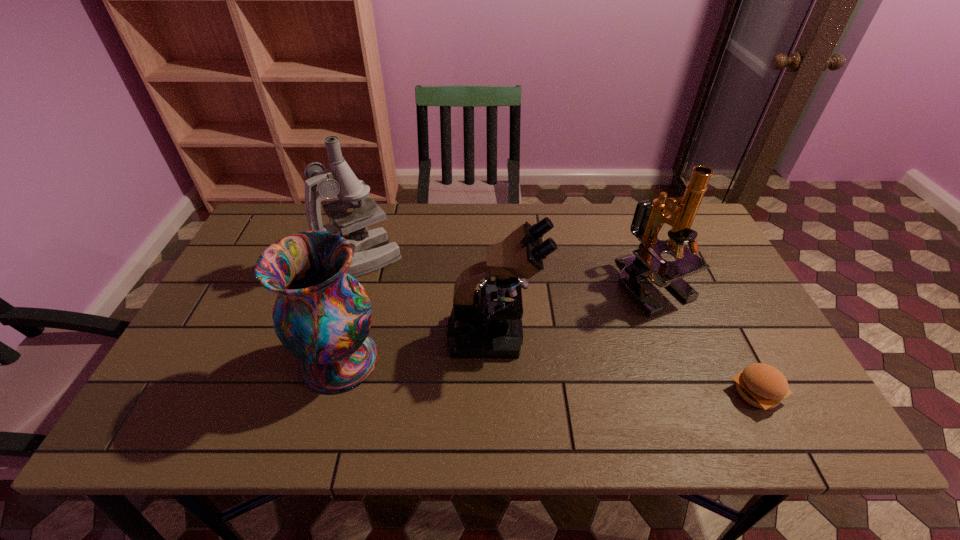
This screenshot has width=960, height=540. In order to click on the leftmost microscope in this screenshot , I will do `click(371, 250)`.

What are the coordinates of `the rightmost microscope` in the screenshot? It's located at (649, 217).

Identify the location of the third object from left to right. (479, 327).

Where is `vase`? This screenshot has height=540, width=960. vase is located at coordinates (322, 315).

This screenshot has height=540, width=960. Identify the location of hamburger. (761, 385).

Image resolution: width=960 pixels, height=540 pixels. I want to click on free region located on the back of the leftmost microscope, so click(x=370, y=228).

Locate an element on the screen. This screenshot has width=960, height=540. vacant space located at the eyepiece of the rightmost microscope is located at coordinates (697, 392).

Locate an element on the screen. Image resolution: width=960 pixels, height=540 pixels. vacant space positioned on the left of the third object from right to left is located at coordinates (x=385, y=335).

This screenshot has height=540, width=960. What are the coordinates of `vacant space situated on the back of the vase` in the screenshot? It's located at (367, 265).

Locate an element on the screen. This screenshot has height=540, width=960. free region located 0.260m on the back of the hamburger is located at coordinates (705, 291).